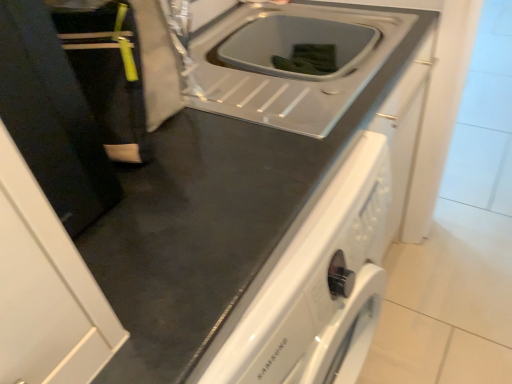
Question: Is white glossy sink at center at the left side of black matte door at left?

Choices:
 (A) yes
 (B) no

Answer: (B)

Question: From the image's perspective, does white glossy sink at center appear lower than black matte door at left?

Choices:
 (A) no
 (B) yes

Answer: (A)

Question: From a real-world perspective, is white glossy sink at center located beneath black matte door at left?

Choices:
 (A) yes
 (B) no

Answer: (A)

Question: Is white glossy sink at center closer to the viewer compared to black matte door at left?

Choices:
 (A) yes
 (B) no

Answer: (B)

Question: Does white glossy sink at center have a larger size compared to black matte door at left?

Choices:
 (A) yes
 (B) no

Answer: (A)

Question: From a real-world perspective, is black fabric at left physically located above or below white glossy sink at center?

Choices:
 (A) above
 (B) below

Answer: (A)

Question: In the image, is black fabric at left on the left side or the right side of white glossy sink at center?

Choices:
 (A) left
 (B) right

Answer: (A)

Question: Based on their sizes in the image, would you say black fabric at left is bigger or smaller than white glossy sink at center?

Choices:
 (A) small
 (B) big

Answer: (A)

Question: Considering the positions of black fabric at left and white glossy sink at center in the image, is black fabric at left taller or shorter than white glossy sink at center?

Choices:
 (A) tall
 (B) short

Answer: (A)

Question: Based on their sizes in the image, would you say black matte door at left is bigger or smaller than white glossy sink at center?

Choices:
 (A) big
 (B) small

Answer: (B)

Question: Is black matte door at left spatially inside white glossy sink at center, or outside of it?

Choices:
 (A) outside
 (B) inside

Answer: (A)

Question: In terms of height, does black matte door at left look taller or shorter compared to white glossy sink at center?

Choices:
 (A) tall
 (B) short

Answer: (A)

Question: Is black matte door at left to the left or to the right of white glossy sink at center in the image?

Choices:
 (A) left
 (B) right

Answer: (A)

Question: From the image's perspective, is black fabric at left positioned above or below black matte door at left?

Choices:
 (A) above
 (B) below

Answer: (A)

Question: In terms of width, does black fabric at left look wider or thinner when compared to black matte door at left?

Choices:
 (A) thin
 (B) wide

Answer: (A)